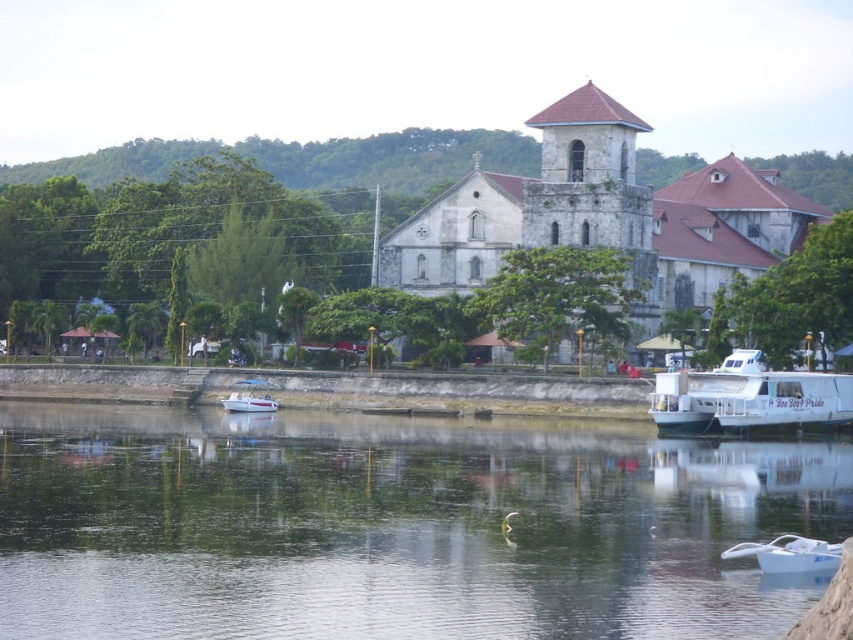
You are standing on the riverside and want to take a photo of both the white stone church at center and the white glossy boat at center. If your camera can focus on objects up to 30 meters away, will both subjects be in focus?

The white stone church at center is 30.39 meters away from the white glossy boat at center. Since the camera can focus up to 30 meters, the distance between them exceeds the camera range. Therefore, both subjects cannot be in focus simultaneously.